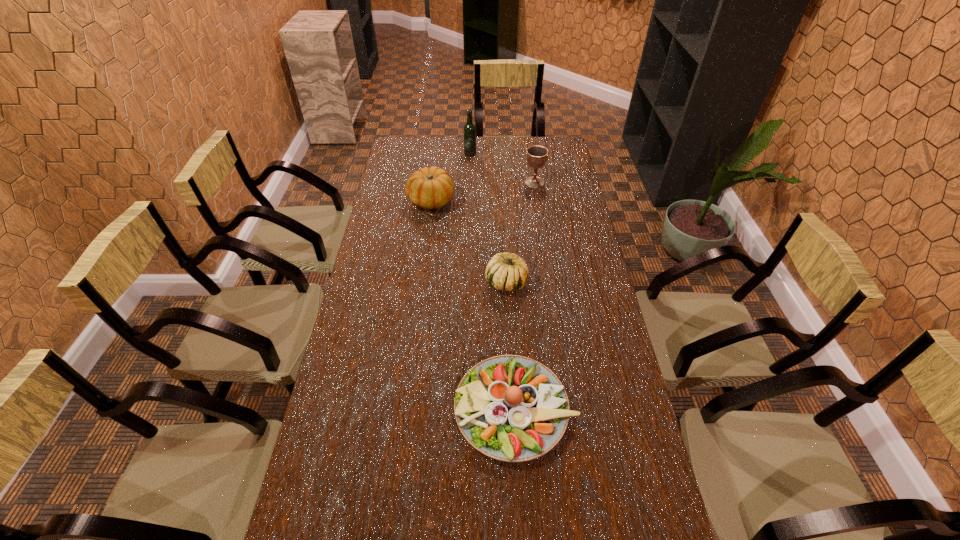
What are the coordinates of `blank space that satisfies the following two spatial constraints: 1. on the front side of the farthest object; 2. on the right side of the second tallest object` in the screenshot? It's located at (469, 183).